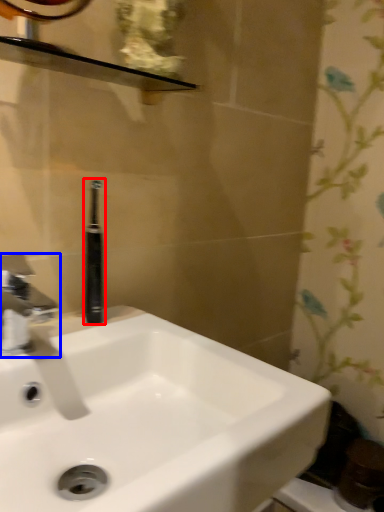
Question: Which of the following is the farthest to the observer, toiletry (highlighted by a red box) or tap (highlighted by a blue box)?

Choices:
 (A) toiletry
 (B) tap

Answer: (A)